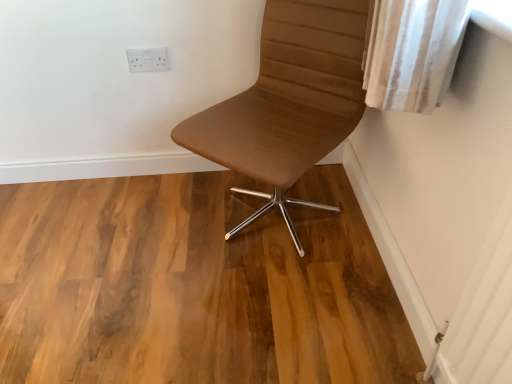
Question: From a real-world perspective, is natural wood floor at center under brown leather chair at center?

Choices:
 (A) yes
 (B) no

Answer: (A)

Question: Does natural wood floor at center have a greater height compared to brown leather chair at center?

Choices:
 (A) yes
 (B) no

Answer: (B)

Question: Is the depth of natural wood floor at center less than that of brown leather chair at center?

Choices:
 (A) no
 (B) yes

Answer: (A)

Question: Is natural wood floor at center thinner than brown leather chair at center?

Choices:
 (A) yes
 (B) no

Answer: (B)

Question: Is the position of natural wood floor at center more distant than that of brown leather chair at center?

Choices:
 (A) yes
 (B) no

Answer: (A)

Question: From a real-world perspective, is natural wood floor at center over brown leather chair at center?

Choices:
 (A) yes
 (B) no

Answer: (B)

Question: From the image's perspective, would you say white plastic outlet at upper center is shown under natural wood floor at center?

Choices:
 (A) no
 (B) yes

Answer: (A)

Question: From a real-world perspective, is white plastic outlet at upper center located beneath natural wood floor at center?

Choices:
 (A) no
 (B) yes

Answer: (A)

Question: Is white plastic outlet at upper center not close to natural wood floor at center?

Choices:
 (A) no
 (B) yes

Answer: (A)

Question: Does white plastic outlet at upper center turn towards natural wood floor at center?

Choices:
 (A) yes
 (B) no

Answer: (B)

Question: Is white plastic outlet at upper center positioned behind natural wood floor at center?

Choices:
 (A) yes
 (B) no

Answer: (A)

Question: Is natural wood floor at center at the back of white plastic outlet at upper center?

Choices:
 (A) yes
 (B) no

Answer: (B)

Question: Is the position of brown leather chair at center more distant than that of natural wood floor at center?

Choices:
 (A) yes
 (B) no

Answer: (B)